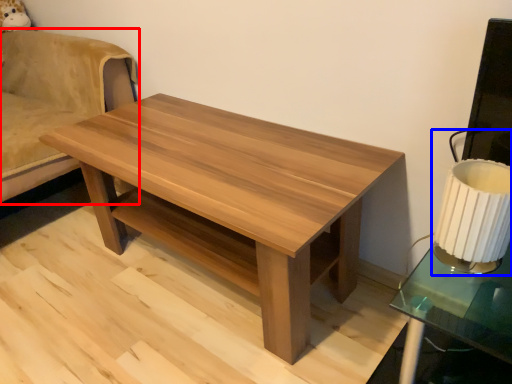
Question: Which of the following is the closest to the observer, swivel chair (highlighted by a red box) or table lamp (highlighted by a blue box)?

Choices:
 (A) swivel chair
 (B) table lamp

Answer: (B)